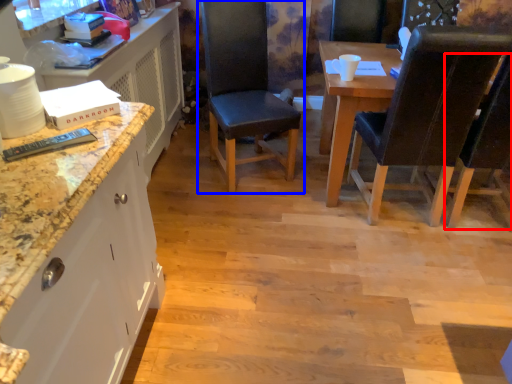
Question: Which point is further to the camera, chair (highlighted by a red box) or chair (highlighted by a blue box)?

Choices:
 (A) chair
 (B) chair

Answer: (B)